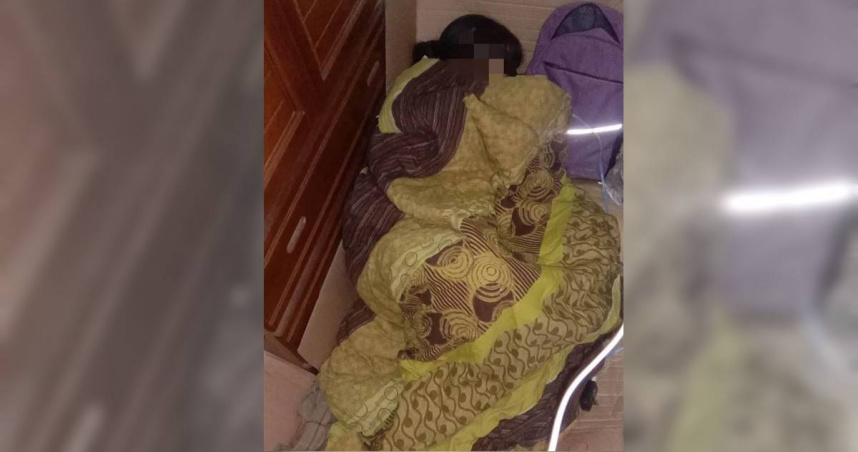
Image resolution: width=858 pixels, height=452 pixels. I want to click on drawer in dresser, so click(x=323, y=204).